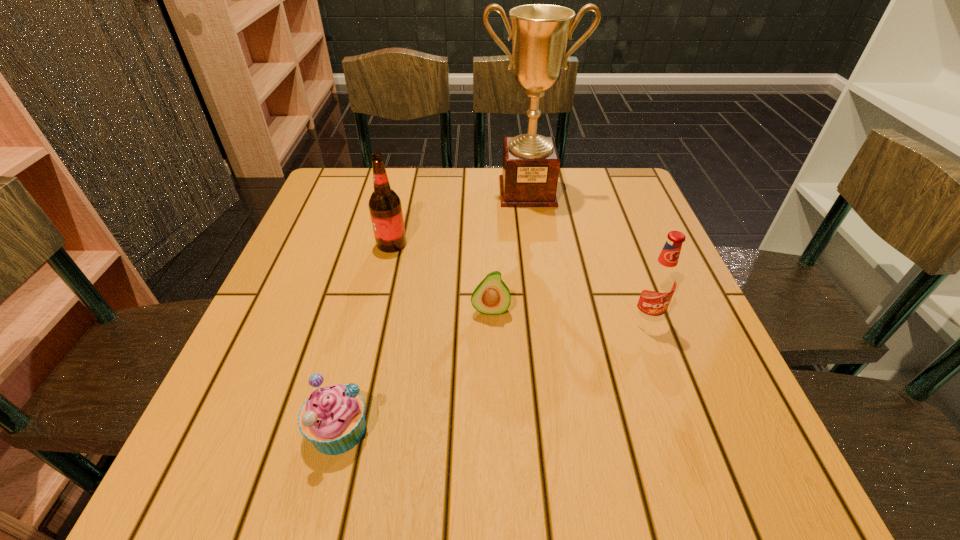
What are the coordinates of `vacant space located on the front of the nearer root beer` in the screenshot? It's located at (680, 413).

You are a GUI agent. You are given a task and a screenshot of the screen. Output one action in this format:
    pyautogui.click(x=<x>, y=<y>)
    Task: Click on the vacant space positioned on the cut side of the avocado
    The height and width of the screenshot is (540, 960).
    Given the screenshot: What is the action you would take?
    493,443

You are a GUI agent. You are given a task and a screenshot of the screen. Output one action in this format:
    pyautogui.click(x=<x>, y=<y>)
    Task: Click on the free region located on the back of the nearest object
    
    Given the screenshot: What is the action you would take?
    pyautogui.click(x=354, y=366)

What are the coordinates of `object present at the far edge` in the screenshot? It's located at (540, 32).

At what (x,y) coordinates should I click in order to perform the action: click on object that is positioned at the near edge. Please return your answer as a coordinate pair (x, y). The height and width of the screenshot is (540, 960). Looking at the image, I should click on (332, 418).

You are a GUI agent. You are given a task and a screenshot of the screen. Output one action in this format:
    pyautogui.click(x=<x>, y=<y>)
    Task: Click on the object that is at the left edge
    
    Given the screenshot: What is the action you would take?
    pyautogui.click(x=332, y=418)

In order to click on object present at the right edge in this screenshot , I will do `click(660, 281)`.

You are a GUI agent. You are given a task and a screenshot of the screen. Output one action in this format:
    pyautogui.click(x=<x>, y=<y>)
    Task: Click on the object that is positioned at the near left corner
    The width and height of the screenshot is (960, 540).
    Given the screenshot: What is the action you would take?
    pyautogui.click(x=332, y=418)

This screenshot has width=960, height=540. In the image, there is a desktop. In order to click on vacant space at the far edge in this screenshot , I will do pyautogui.click(x=478, y=199).

Locate an element on the screen. This screenshot has height=540, width=960. free region at the left edge of the desktop is located at coordinates (360, 247).